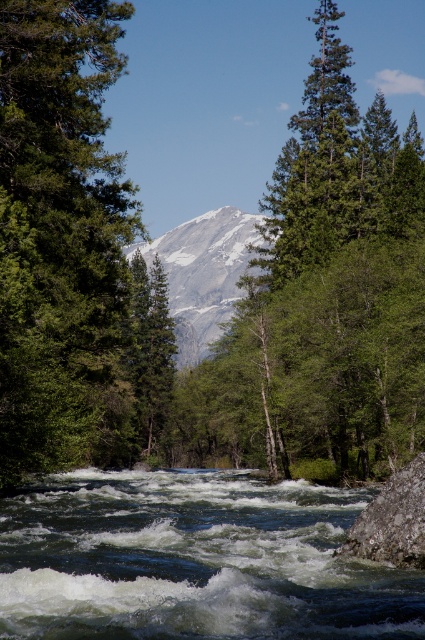
Which is below, green matte tree at center or gray rough rock at lower right?

gray rough rock at lower right is lower down.

Is point (10, 381) closer to camera compared to point (405, 500)?

No, (10, 381) is behind (405, 500).

You are a GUI agent. You are given a task and a screenshot of the screen. Output one action in this format:
    pyautogui.click(x=<x>, y=<y>)
    Task: Click on the green matte tree at center
    The width and height of the screenshot is (425, 640).
    Given the screenshot: What is the action you would take?
    pyautogui.click(x=59, y=228)

Which is below, snowy granite mountain at center or gray rough rock at lower right?

gray rough rock at lower right

Does snowy granite mountain at center have a lesser width compared to gray rough rock at lower right?

Incorrect, snowy granite mountain at center's width is not less than gray rough rock at lower right's.

Describe the element at coordinates (203, 273) in the screenshot. This screenshot has height=640, width=425. I see `snowy granite mountain at center` at that location.

Where is `snowy granite mountain at center`? The width and height of the screenshot is (425, 640). snowy granite mountain at center is located at coordinates (203, 273).

Does green matte tree at center have a greater height compared to snowy granite mountain at center?

No, green matte tree at center is not taller than snowy granite mountain at center.

Between green matte tree at center and snowy granite mountain at center, which one appears on the left side from the viewer's perspective?

Positioned to the left is snowy granite mountain at center.

Is point (33, 163) positioned in front of point (172, 316)?

That is True.

You are a GUI agent. You are given a task and a screenshot of the screen. Output one action in this format:
    pyautogui.click(x=<x>, y=<y>)
    Task: Click on the green matte tree at center
    Image resolution: width=425 pixels, height=640 pixels.
    Given the screenshot: What is the action you would take?
    pyautogui.click(x=59, y=228)